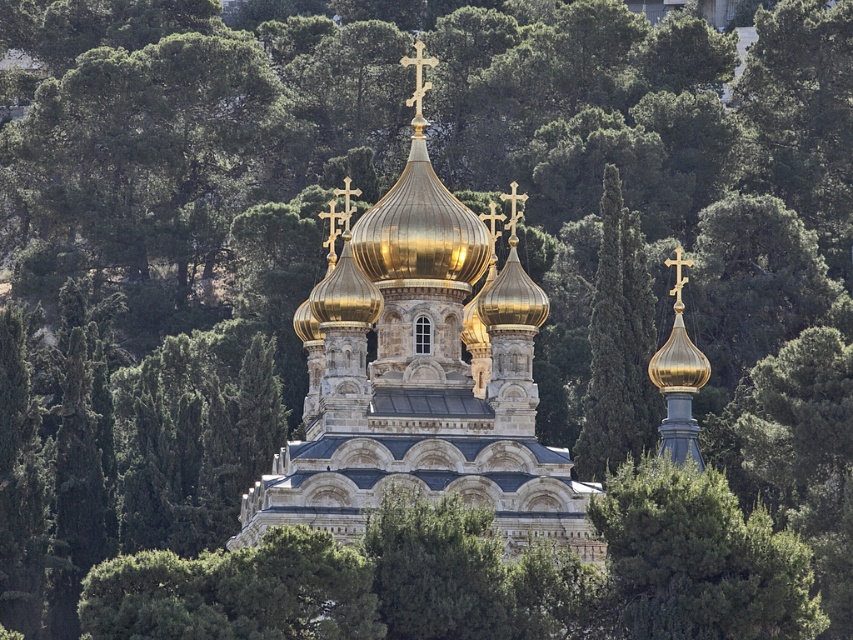
Question: Which of the following is the closest to the observer?

Choices:
 (A) green leafy tree at center
 (B) gold stone church at center

Answer: (A)

Question: Among these points, which one is farthest from the camera?

Choices:
 (A) (463, 477)
 (B) (752, 525)

Answer: (A)

Question: Which of the following is the closest to the observer?

Choices:
 (A) gold stone church at center
 (B) green leafy tree at center

Answer: (B)

Question: Can you confirm if gold stone church at center is positioned to the left of green leafy tree at center?

Choices:
 (A) no
 (B) yes

Answer: (B)

Question: Does gold stone church at center have a larger size compared to green leafy tree at center?

Choices:
 (A) yes
 (B) no

Answer: (A)

Question: Does gold stone church at center have a greater width compared to green leafy tree at center?

Choices:
 (A) no
 (B) yes

Answer: (B)